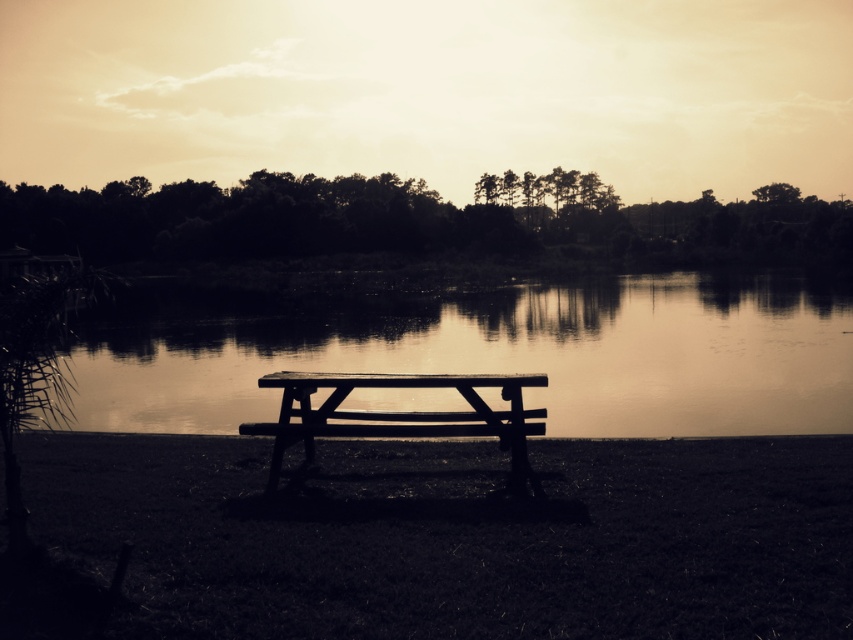
Which is behind, point (584, 300) or point (421, 428)?

The point (584, 300) is behind.

Is smooth water at bench left below wooden bench at center?

Incorrect, smooth water at bench left is not positioned below wooden bench at center.

Between point (677, 404) and point (254, 429), which one is positioned behind?

Positioned behind is point (677, 404).

Locate an element on the screen. smooth water at bench left is located at coordinates (509, 356).